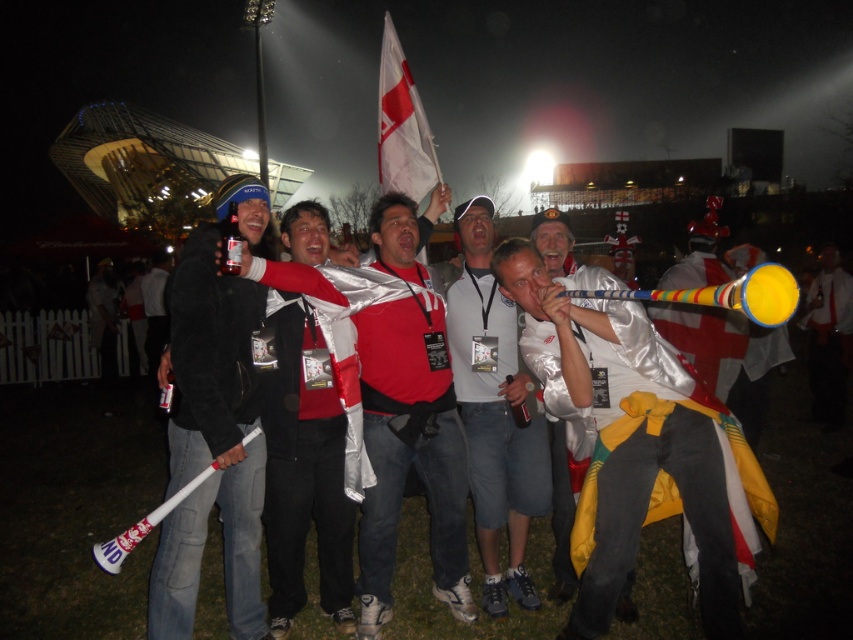
Is the position of shiny silver jacket at center less distant than that of white matte shirt at center?

Yes.

Consider the image. Who is more forward, (x=648, y=323) or (x=451, y=292)?

Point (x=648, y=323) is more forward.

At what (x,y) coordinates should I click in order to perform the action: click on shiny silver jacket at center. Please return your answer as a coordinate pair (x, y). Looking at the image, I should click on (636, 442).

Who is positioned more to the left, metallic silver flag at center or shiny silver helmet at center?

From the viewer's perspective, shiny silver helmet at center appears more on the left side.

What do you see at coordinates (704, 340) in the screenshot? Image resolution: width=853 pixels, height=640 pixels. I see `metallic silver flag at center` at bounding box center [704, 340].

What do you see at coordinates (704, 340) in the screenshot? This screenshot has width=853, height=640. I see `metallic silver flag at center` at bounding box center [704, 340].

Locate an element on the screen. metallic silver flag at center is located at coordinates (704, 340).

Between shiny silver jacket at center and silver metallic jacket at center, which one is positioned higher?

Positioned higher is silver metallic jacket at center.

The image size is (853, 640). Describe the element at coordinates (636, 442) in the screenshot. I see `shiny silver jacket at center` at that location.

Who is more forward, (624, 456) or (190, 554)?

Point (624, 456) is in front.

Identify the location of shiny silver jacket at center. The image size is (853, 640). (636, 442).